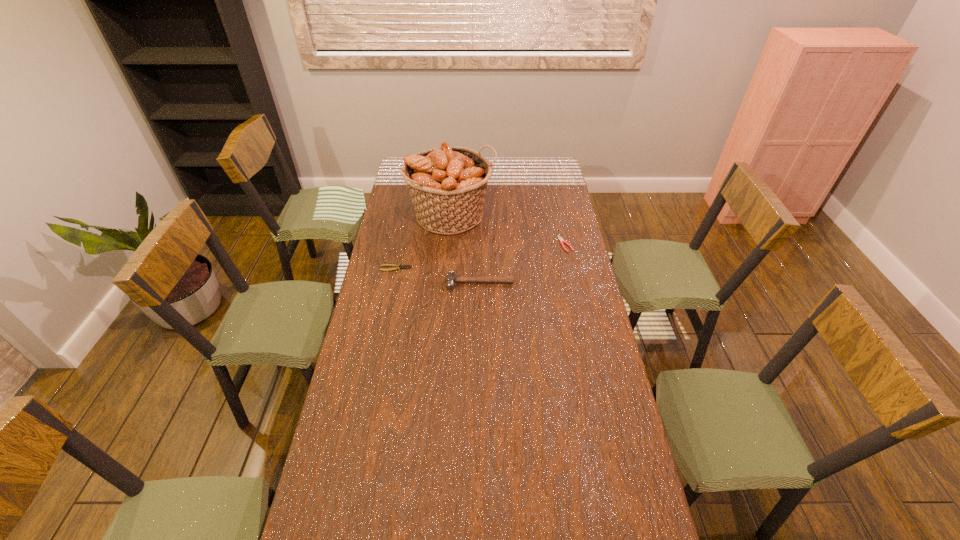
I want to click on free space located on the back of the left pliers, so click(x=405, y=222).

Identify the location of basket located at the left edge. This screenshot has height=540, width=960. (447, 184).

Identify the location of pliers present at the left edge. The width and height of the screenshot is (960, 540). (396, 267).

Find the location of a particular element. The image size is (960, 540). object at the right edge is located at coordinates (562, 241).

I want to click on free location at the far edge, so (525, 179).

The image size is (960, 540). Identify the location of free point at the left edge. (361, 329).

The width and height of the screenshot is (960, 540). I want to click on vacant space at the right edge of the desktop, so click(550, 186).

Locate an element on the screen. The height and width of the screenshot is (540, 960). free space that is in between the right pliers and the nearer pliers is located at coordinates pyautogui.click(x=481, y=256).

Locate an element on the screen. The height and width of the screenshot is (540, 960). blank region between the left pliers and the farther pliers is located at coordinates (481, 256).

Image resolution: width=960 pixels, height=540 pixels. Find the location of `free spot between the farther pliers and the second nearest object`. free spot between the farther pliers and the second nearest object is located at coordinates click(481, 256).